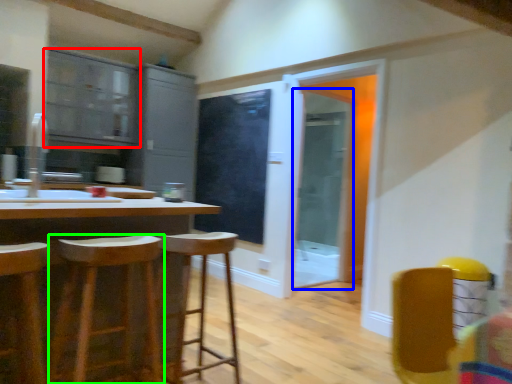
Question: Which is farther away from cabinetry (highlighted by a red box)? screen door (highlighted by a blue box) or stool (highlighted by a green box)?

Choices:
 (A) screen door
 (B) stool

Answer: (B)